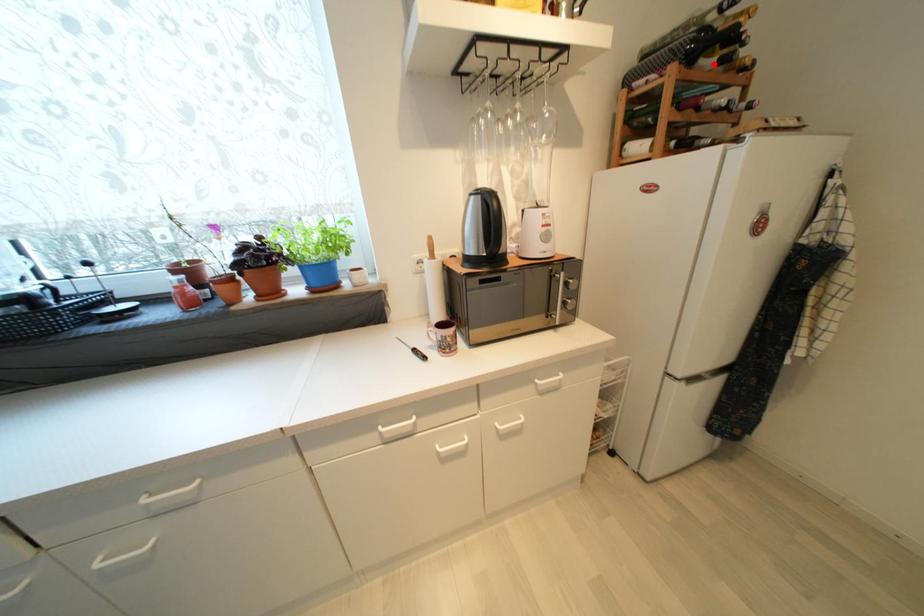
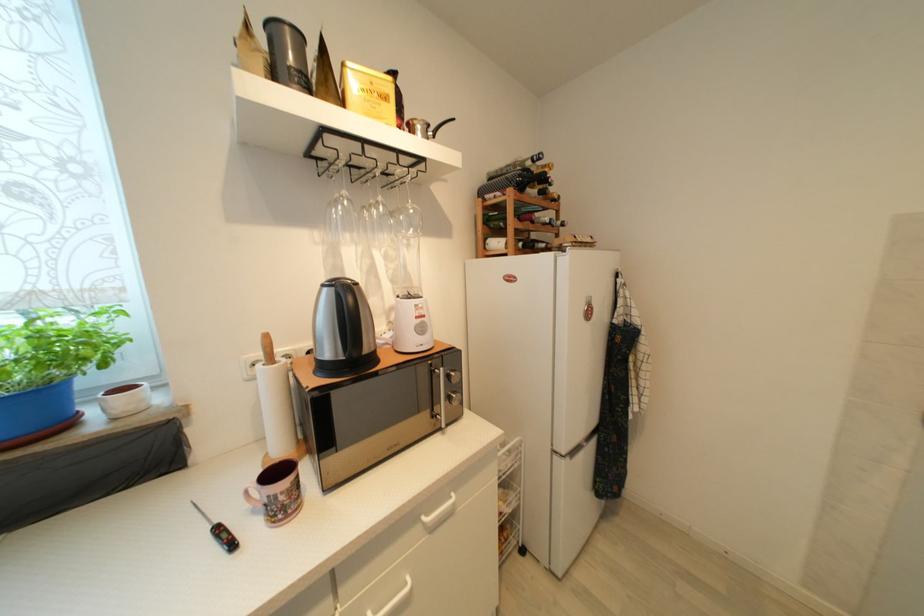
Locate, in the second image, the point that corresponds to the highlighted location in the first image.

(538, 193)